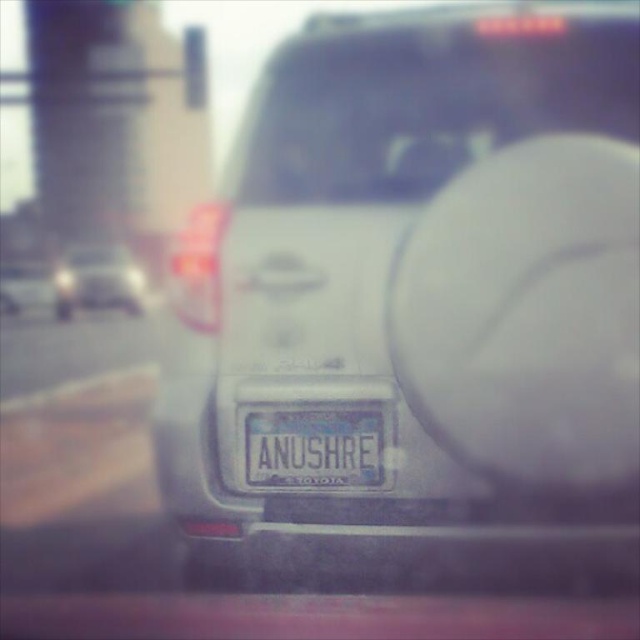
Question: Among these objects, which one is nearest to the camera?

Choices:
 (A) transparent glass windshield at center
 (B) white glossy rearview mirror at center
 (C) transparent glass traffic light at upper center
 (D) matte silver car at center

Answer: (B)

Question: Can you confirm if white glossy rearview mirror at center is wider than matte silver car at center?

Choices:
 (A) yes
 (B) no

Answer: (B)

Question: Which object is the closest to the transparent glass windshield at center?

Choices:
 (A) metallic silver car at left
 (B) satin silver suv at center

Answer: (B)

Question: Is white glossy rearview mirror at center thinner than matte silver car at center?

Choices:
 (A) yes
 (B) no

Answer: (A)

Question: Where is white glossy rearview mirror at center located in relation to metallic silver car at left in the image?

Choices:
 (A) below
 (B) above

Answer: (A)

Question: Estimate the real-world distances between objects in this image. Which object is closer to the matte silver car at center?

Choices:
 (A) white metallic license plate at center
 (B) transparent glass windshield at center

Answer: (B)